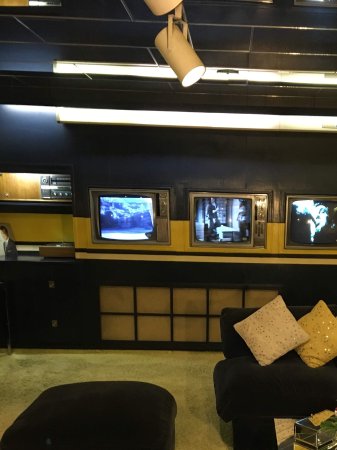
Where is `footstool`? This screenshot has height=450, width=337. footstool is located at coordinates (122, 439).